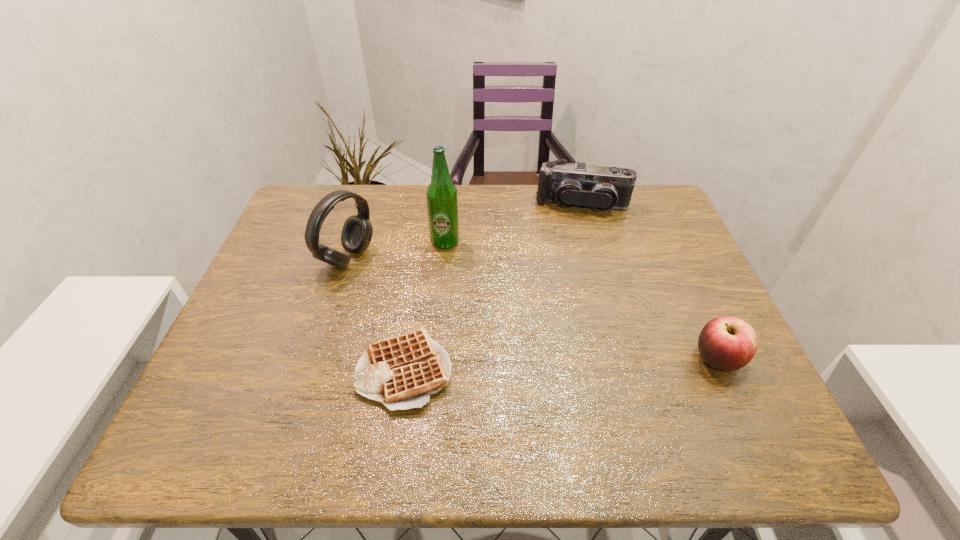
This screenshot has width=960, height=540. In order to click on waffle in this screenshot , I will do `click(401, 372)`.

The height and width of the screenshot is (540, 960). In order to click on the second shortest object in this screenshot , I will do `click(726, 343)`.

I want to click on apple, so click(x=726, y=343).

Image resolution: width=960 pixels, height=540 pixels. Find the location of `camcorder`. camcorder is located at coordinates (602, 188).

You are a GUI agent. You are given a task and a screenshot of the screen. Output one action in this format:
    pyautogui.click(x=<x>, y=<y>)
    Task: Click on the farthest object
    The image size is (960, 540).
    Given the screenshot: What is the action you would take?
    pyautogui.click(x=602, y=188)

In order to click on beer bottle in this screenshot , I will do `click(442, 200)`.

I want to click on the fourth shortest object, so click(357, 231).

I want to click on headset, so click(357, 231).

The height and width of the screenshot is (540, 960). In order to click on vacant space situated 0.310m on the left of the waffle in this screenshot , I will do `click(214, 369)`.

Identify the location of free location located on the front-facing side of the farthest object. (572, 257).